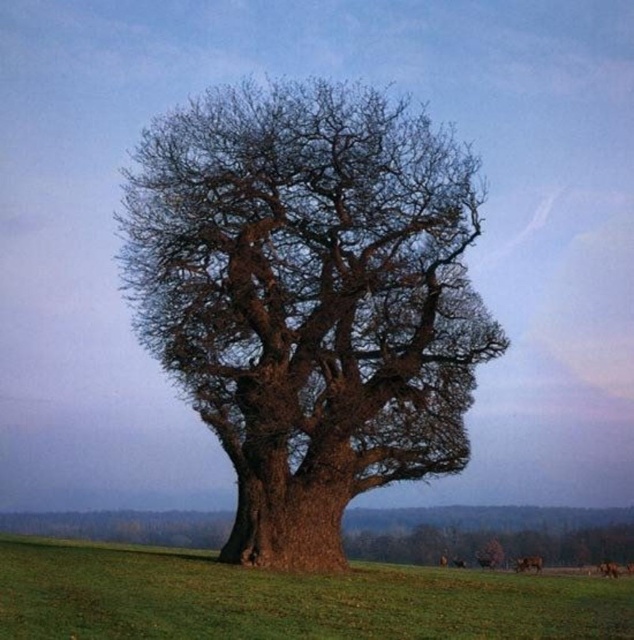
Question: Which of the following is the closest to the observer?

Choices:
 (A) (524, 566)
 (B) (612, 573)
 (C) (236, 211)
 (D) (145, 596)

Answer: (D)

Question: Can you confirm if green grassy field at center is wider than brown furry dog at lower right?

Choices:
 (A) no
 (B) yes

Answer: (B)

Question: Can you confirm if brown rough bark oak tree at center is smaller than green grassy field at center?

Choices:
 (A) yes
 (B) no

Answer: (B)

Question: Among these points, which one is nearest to the camera?

Choices:
 (A) (56, 611)
 (B) (611, 570)
 (C) (527, 564)
 (D) (288, 314)

Answer: (A)

Question: Among these objects, which one is farthest from the camera?

Choices:
 (A) brown furry horse at center
 (B) brown furry dog at lower right
 (C) brown rough bark oak tree at center
 (D) green grassy field at center

Answer: (B)

Question: Can you confirm if brown furry dog at lower right is thinner than brown furry horse at center?

Choices:
 (A) yes
 (B) no

Answer: (B)